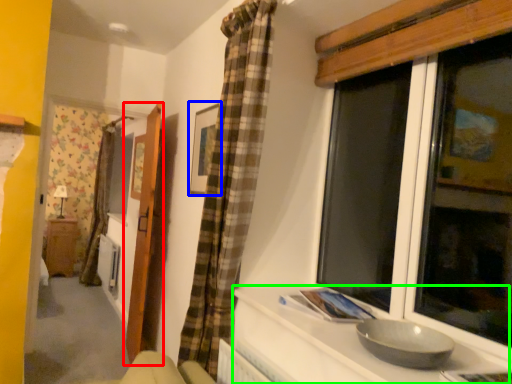
Question: Which object is positioned farthest from door (highlighted by a red box)? Select from picture frame (highlighted by a blue box) and counter top (highlighted by a green box).

Choices:
 (A) picture frame
 (B) counter top

Answer: (B)